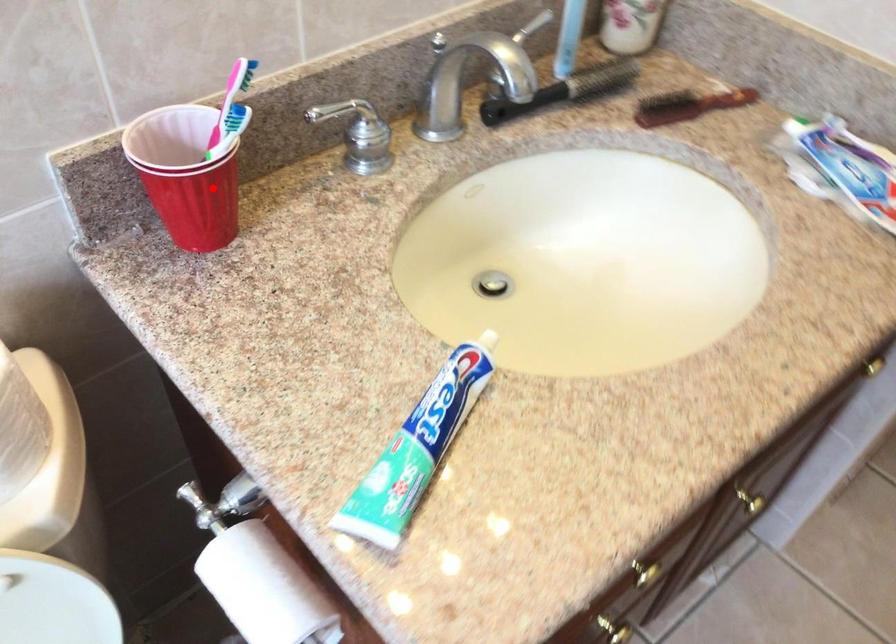
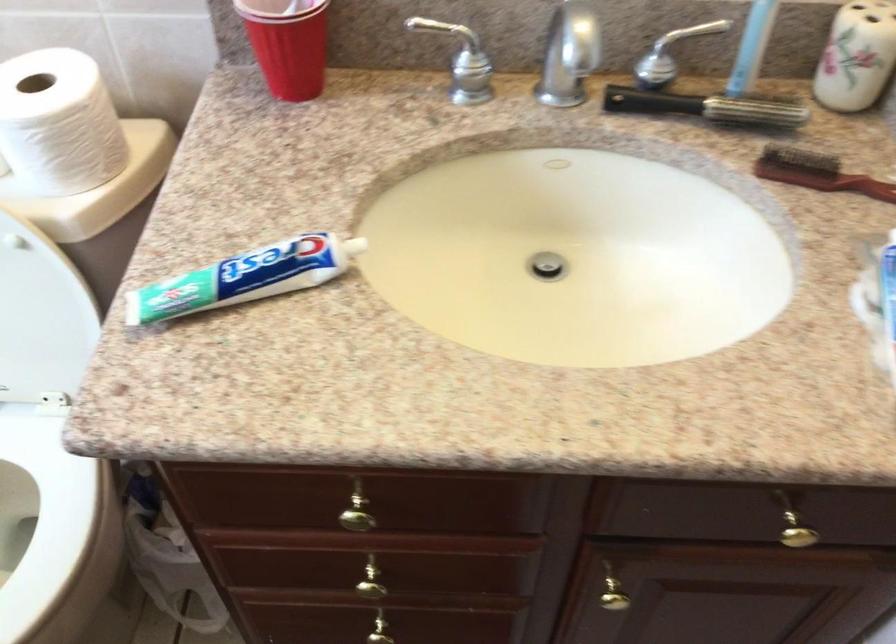
Question: I am providing you with two images of the same scene from different viewpoints. A red point is marked on the first image. Is the red point's position out of view in image 2?

Choices:
 (A) Yes
 (B) No

Answer: (B)